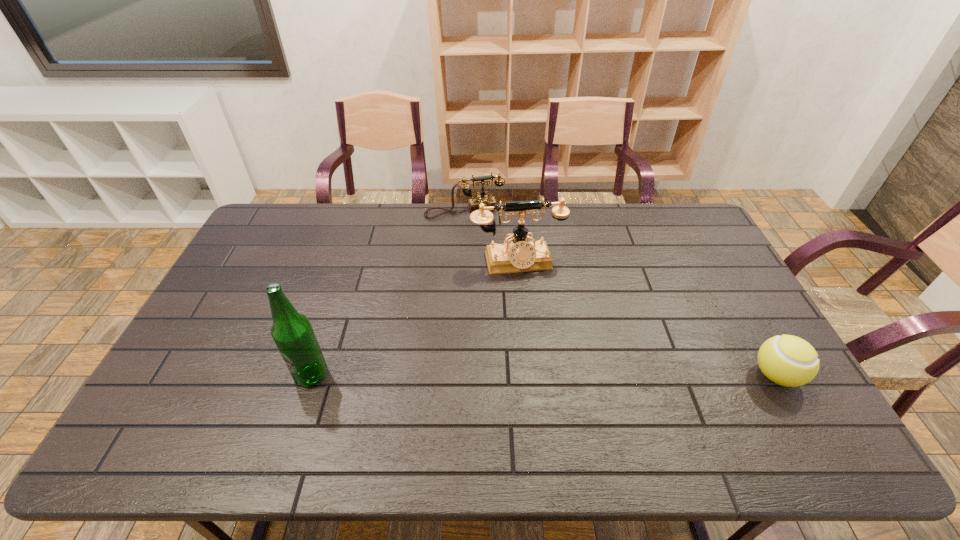
Find the location of `free point between the tennis ball and the farther telephone`. free point between the tennis ball and the farther telephone is located at coordinates (620, 293).

You are a GUI agent. You are given a task and a screenshot of the screen. Output one action in this format:
    pyautogui.click(x=<x>, y=<y>)
    Task: Click on the empty location between the rightmost object and the beer bottle
    This screenshot has height=540, width=960.
    Given the screenshot: What is the action you would take?
    543,375

I want to click on free space between the rightmost object and the second tallest object, so click(646, 319).

At what (x,y) coordinates should I click in order to perform the action: click on vacant region between the leftmost object and the second tallest object. Please return your answer as a coordinate pair (x, y). The width and height of the screenshot is (960, 540). Looking at the image, I should click on (414, 318).

You are a GUI agent. You are given a task and a screenshot of the screen. Output one action in this format:
    pyautogui.click(x=<x>, y=<y>)
    Task: Click on the vacant space in between the leftmost object and the shorter telephone
    The width and height of the screenshot is (960, 540).
    Given the screenshot: What is the action you would take?
    pyautogui.click(x=388, y=293)

At what (x,y) coordinates should I click in order to perform the action: click on unoccupied area between the rightmost object and the taller telephone. Please return your answer as a coordinate pair (x, y). Image resolution: width=960 pixels, height=540 pixels. Looking at the image, I should click on (646, 319).

You are a GUI agent. You are given a task and a screenshot of the screen. Output one action in this format:
    pyautogui.click(x=<x>, y=<y>)
    Task: Click on the object identified as the second closest to the tallest object
    
    Given the screenshot: What is the action you would take?
    pyautogui.click(x=473, y=204)

Select which object is the second closest to the farthest object. Please provide its 2D coordinates. Your answer should be formatted as a tuple, i.e. [(x, y)], where the tuple contains the x and y coordinates of a point satisfying the conditions above.

[(292, 332)]

I want to click on vacant region that satisfies the following two spatial constraints: 1. on the label of the tennis ball; 2. on the left side of the tallest object, so click(311, 375).

I want to click on free space that satisfies the following two spatial constraints: 1. on the label of the beer bottle; 2. on the right side of the rightmost object, so click(311, 375).